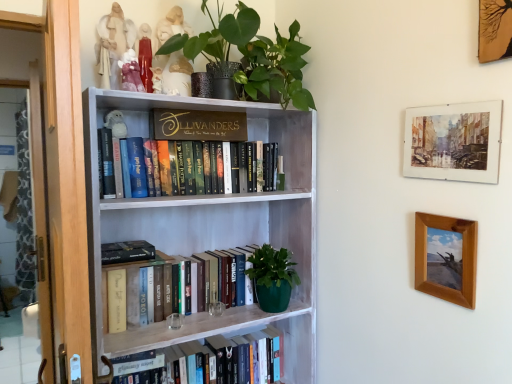
You are a GUI agent. You are given a task and a screenshot of the screen. Output one action in this format:
    pyautogui.click(x=<x>, y=<y>)
    Task: Click on the free spot above transparent glass door at left (from a real-world perspective)
    This screenshot has height=384, width=512.
    Given the screenshot: What is the action you would take?
    pyautogui.click(x=10, y=83)